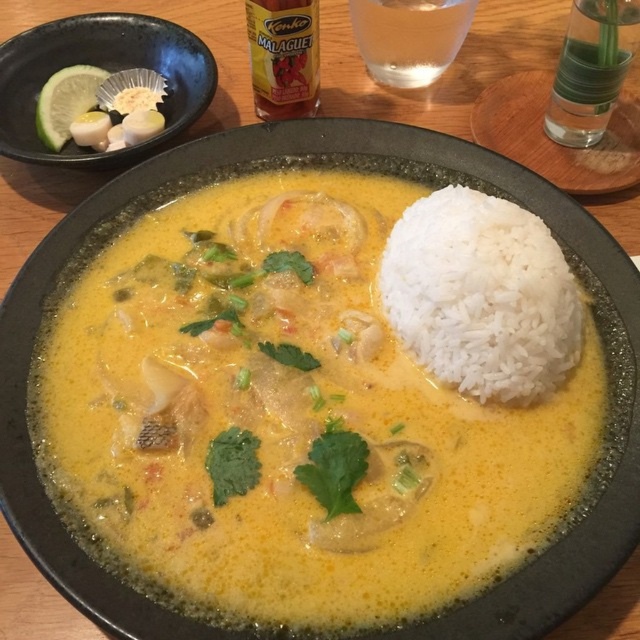
Is black ceramic bowl at upper left smaller than clear glass at upper right?

Incorrect, black ceramic bowl at upper left is not smaller in size than clear glass at upper right.

Which of these two, black ceramic bowl at upper left or clear glass at upper right, stands shorter?

clear glass at upper right

The height and width of the screenshot is (640, 640). What are the coordinates of `black ceramic bowl at upper left` in the screenshot? It's located at (102, 68).

Can you confirm if yellow creamy broth at center is wider than clear glass at upper right?

Yes.

Who is positioned more to the left, yellow creamy broth at center or clear glass at upper right?

Positioned to the left is yellow creamy broth at center.

Does point (248, 301) lie behind point (577, 22)?

No, it is in front of (577, 22).

At what (x,y) coordinates should I click in order to perform the action: click on yellow creamy broth at center. Please return your answer as a coordinate pair (x, y). The height and width of the screenshot is (640, 640). Looking at the image, I should click on (291, 413).

Can you confirm if yellow creamy broth at center is thinner than white polished rice at upper right?

Incorrect, yellow creamy broth at center's width is not less than white polished rice at upper right's.

Who is more forward, (289, 268) or (448, 372)?

Point (448, 372) is more forward.

Find the location of a particular element. yellow creamy broth at center is located at coordinates (291, 413).

Locate an element on the screen. The image size is (640, 640). yellow creamy broth at center is located at coordinates (291, 413).